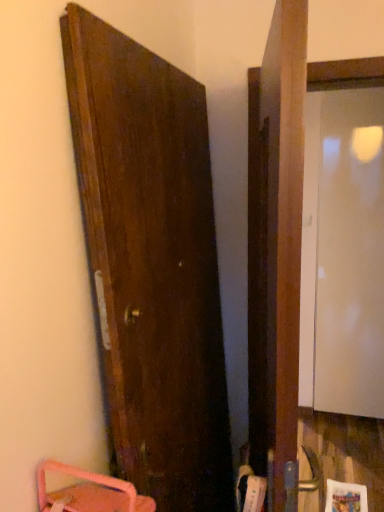
In order to face transparent glass screen door at right, should I rotate leftwards or rightwards?

It's best to rotate right around 20.846 degrees.

Image resolution: width=384 pixels, height=512 pixels. Find the location of `transparent glass screen door at right`. transparent glass screen door at right is located at coordinates (343, 253).

Image resolution: width=384 pixels, height=512 pixels. What do you see at coordinates (343, 253) in the screenshot?
I see `transparent glass screen door at right` at bounding box center [343, 253].

In order to click on transparent glass screen door at right in this screenshot , I will do `click(343, 253)`.